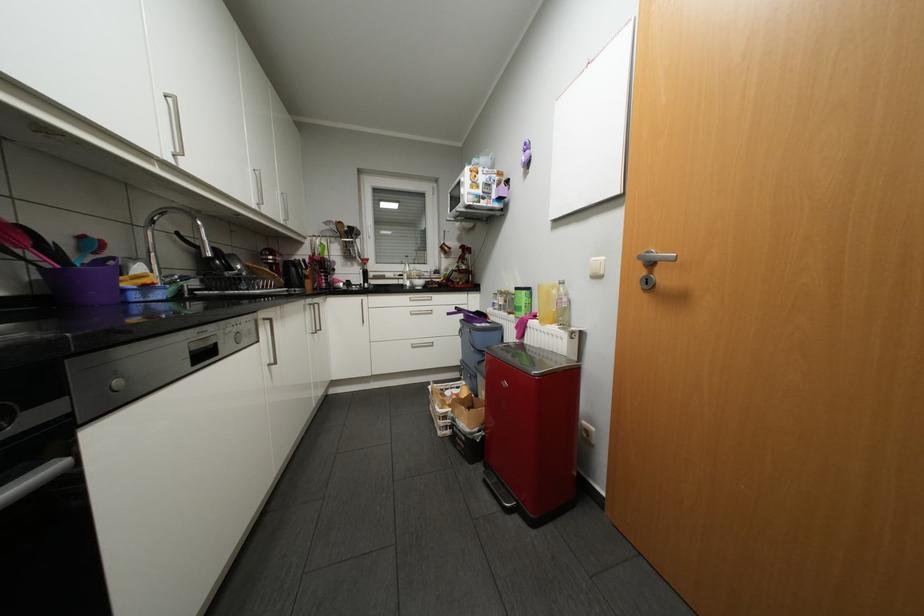
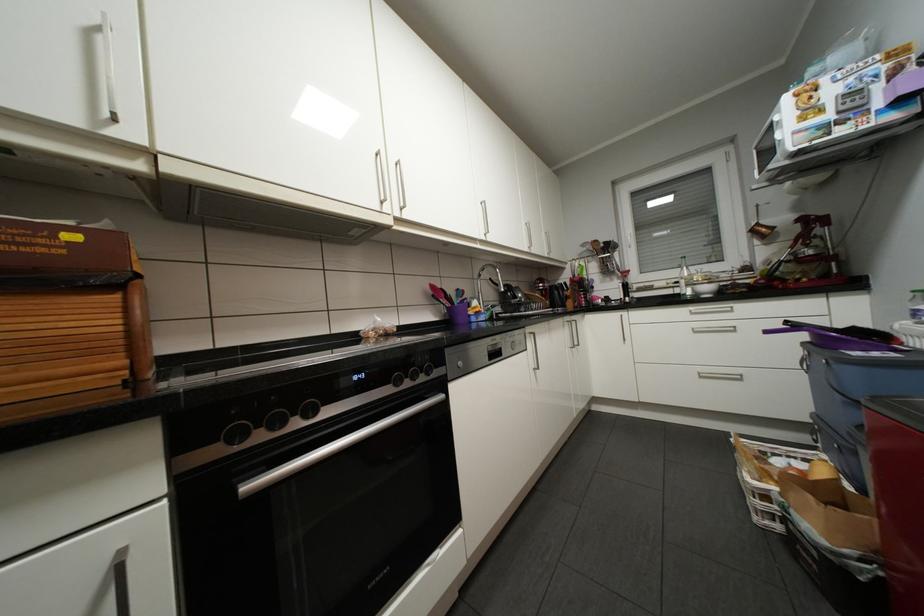
Find the pixel in the second image that matches [361,300] in the first image.

(619, 315)